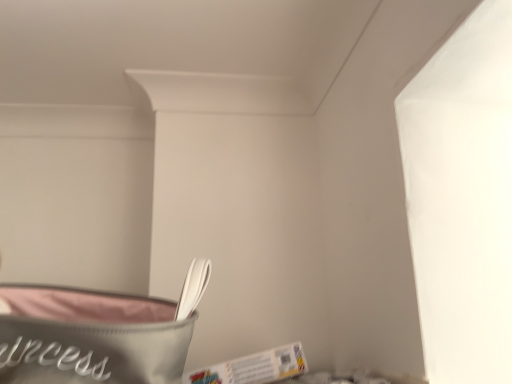
The height and width of the screenshot is (384, 512). Describe the element at coordinates (90, 337) in the screenshot. I see `silver satin sleeping bag at lower left` at that location.

Image resolution: width=512 pixels, height=384 pixels. In order to click on silver satin sleeping bag at lower left in this screenshot , I will do `click(90, 337)`.

Measure the distance between point (x=35, y=331) and camera.

22.09 inches.

Find the location of a particular element. This screenshot has height=384, width=512. silver satin sleeping bag at lower left is located at coordinates (90, 337).